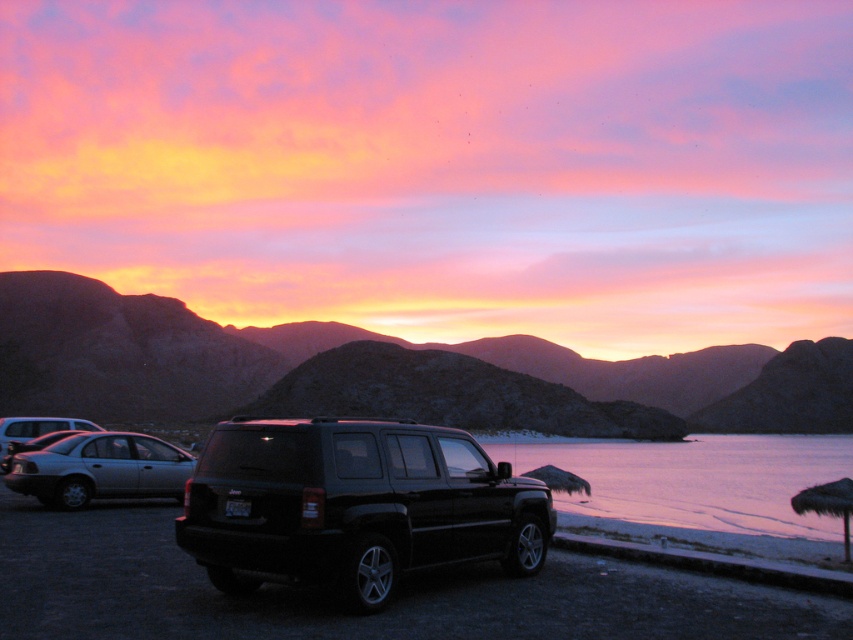
Question: Which point is farther to the camera?

Choices:
 (A) silhouetted rock formation at center
 (B) pink smooth water at lower right
 (C) satin silver sedan at lower left
 (D) black glossy suv at center

Answer: (A)

Question: Is black glossy suv at center positioned in front of satin silver sedan at lower left?

Choices:
 (A) yes
 (B) no

Answer: (A)

Question: In this image, where is silhouetted rock formation at center located relative to pink smooth water at lower right?

Choices:
 (A) right
 (B) left

Answer: (B)

Question: Which point is closer to the camera taking this photo?

Choices:
 (A) (791, 513)
 (B) (45, 460)

Answer: (B)

Question: Does black glossy suv at center come behind pink smooth water at lower right?

Choices:
 (A) no
 (B) yes

Answer: (A)

Question: Which of the following is the closest to the observer?

Choices:
 (A) satin silver sedan at lower left
 (B) black glossy suv at center
 (C) pink smooth water at lower right
 (D) silhouetted rock formation at center

Answer: (B)